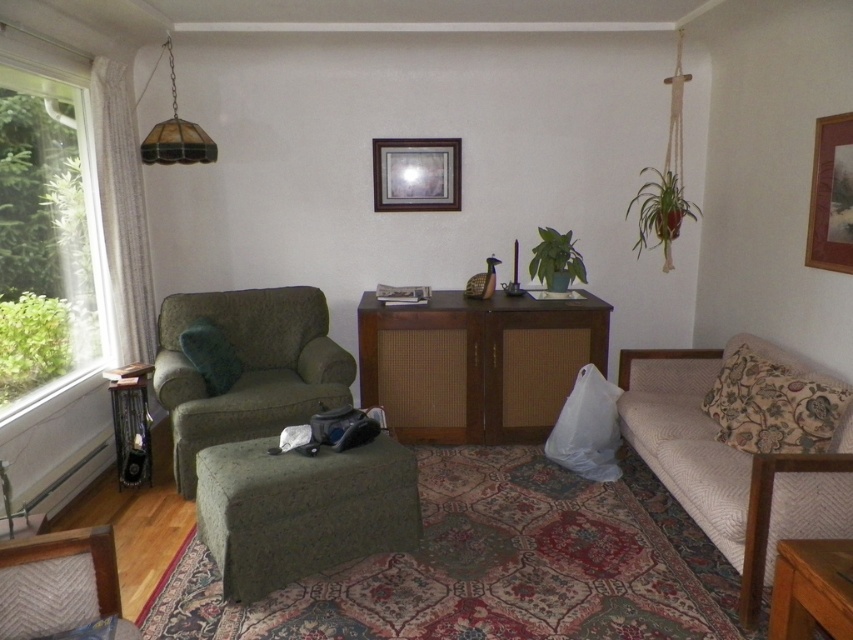
Question: Is green fabric armchair at lower left closer to the viewer compared to wooden table at lower left?

Choices:
 (A) yes
 (B) no

Answer: (A)

Question: Which point is closer to the camera?

Choices:
 (A) (764, 362)
 (B) (821, 497)
 (C) (148, 141)
 (D) (338, 513)

Answer: (B)

Question: Does green fabric ottoman at center appear under green fabric armchair at left?

Choices:
 (A) no
 (B) yes

Answer: (B)

Question: Which point is closer to the camera?

Choices:
 (A) green fabric armchair at lower left
 (B) wooden table at lower right

Answer: (B)

Question: Which of these objects is positioned farthest from the wooden table at lower left?

Choices:
 (A) velvety green pillow at center
 (B) wooden table at lower right
 (C) green fabric ottoman at center
 (D) wooden framed artwork at upper right

Answer: (D)

Question: Observing the image, what is the correct spatial positioning of wooden framed artwork at upper right in reference to wooden table at lower left?

Choices:
 (A) right
 (B) left

Answer: (A)